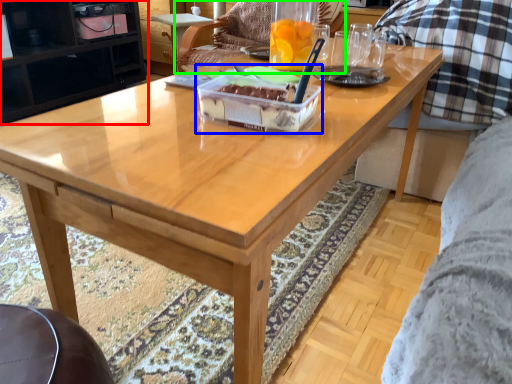
Question: Which is nearer to the cabinetry (highlighted by a red box)? cake (highlighted by a blue box) or chair (highlighted by a green box).

Choices:
 (A) cake
 (B) chair

Answer: (B)